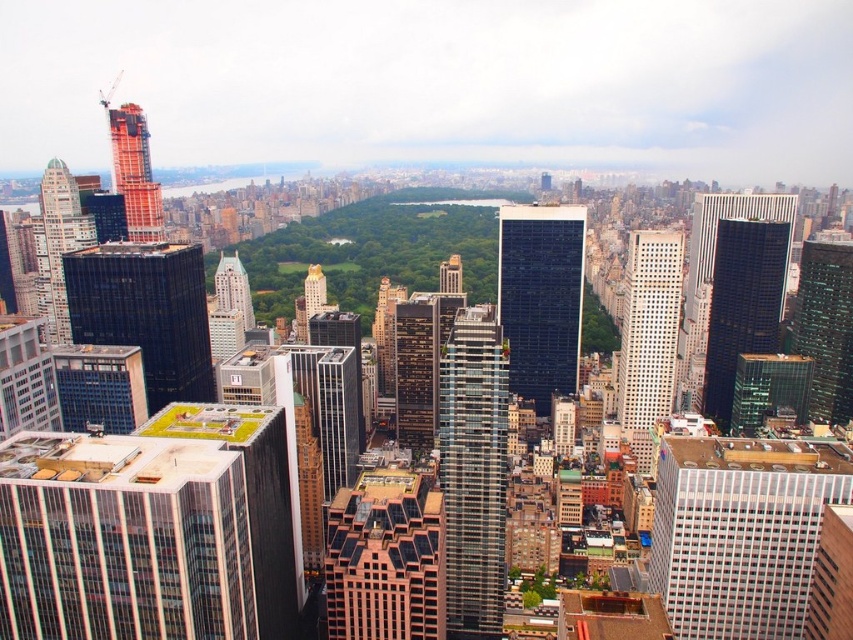
Question: Which of the following is the closest to the observer?

Choices:
 (A) red brick construction at upper left
 (B) dark glass skyscraper at center
 (C) green glass skyscraper at right
 (D) glassy black skyscraper at right

Answer: (B)

Question: Among these points, which one is nearest to the camera?

Choices:
 (A) (393, 572)
 (B) (453, 253)
 (C) (49, 593)
 (D) (144, 115)

Answer: (C)

Question: Where is glassy reflective skyscraper at left located in relation to glassy white skyscraper at center in the image?

Choices:
 (A) right
 (B) left

Answer: (B)

Question: Which object is farther from the camera taking this photo?

Choices:
 (A) shiny black skyscraper at left
 (B) glassy steel skyscraper at center
 (C) green glass skyscraper at right
 (D) gold leaf tower at center

Answer: (C)

Question: Is matte glass skyscraper at center-right positioned at the back of red brick construction at upper left?

Choices:
 (A) yes
 (B) no

Answer: (B)

Question: Is glassy black skyscraper at right thinner than gold leaf tower at center?

Choices:
 (A) yes
 (B) no

Answer: (B)